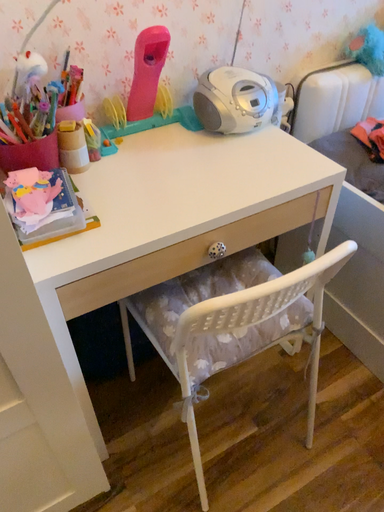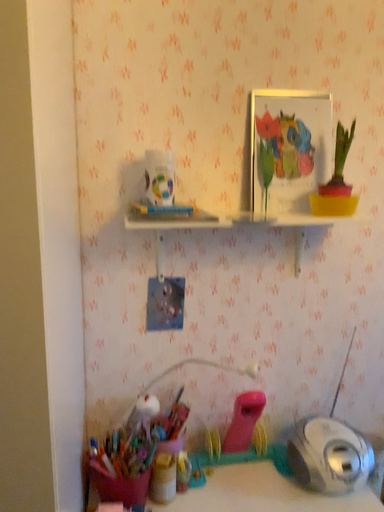
Question: Which way did the camera rotate in the video?

Choices:
 (A) rotated upward
 (B) rotated downward

Answer: (A)